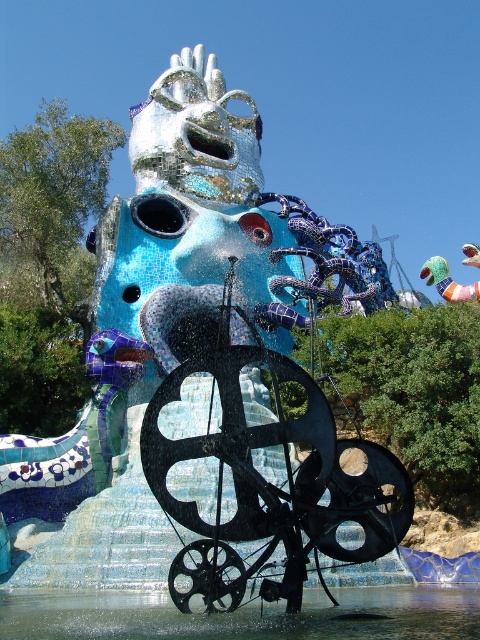
Question: Can you confirm if clear water at center is smaller than matte pink toy at upper right?

Choices:
 (A) yes
 (B) no

Answer: (A)

Question: Can you confirm if clear water at center is bigger than matte pink toy at upper right?

Choices:
 (A) yes
 (B) no

Answer: (B)

Question: In this image, where is clear water at center located relative to matte pink toy at upper right?

Choices:
 (A) right
 (B) left

Answer: (B)

Question: Among these objects, which one is nearest to the camera?

Choices:
 (A) clear water at center
 (B) matte pink toy at upper right

Answer: (A)

Question: Which point appears closest to the camera in this image?

Choices:
 (A) (436, 273)
 (B) (312, 608)

Answer: (B)

Question: Among these objects, which one is nearest to the camera?

Choices:
 (A) matte pink toy at upper right
 (B) clear water at center

Answer: (B)